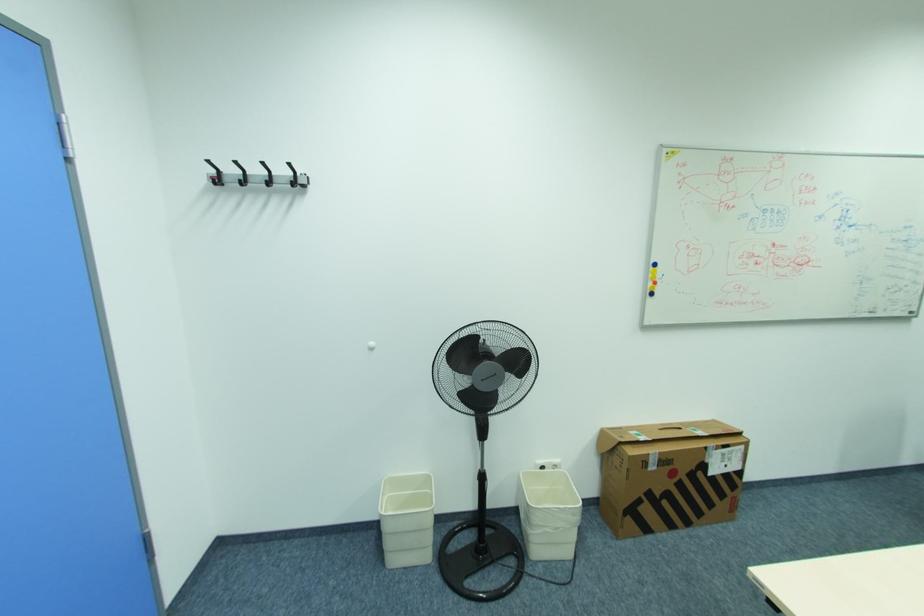
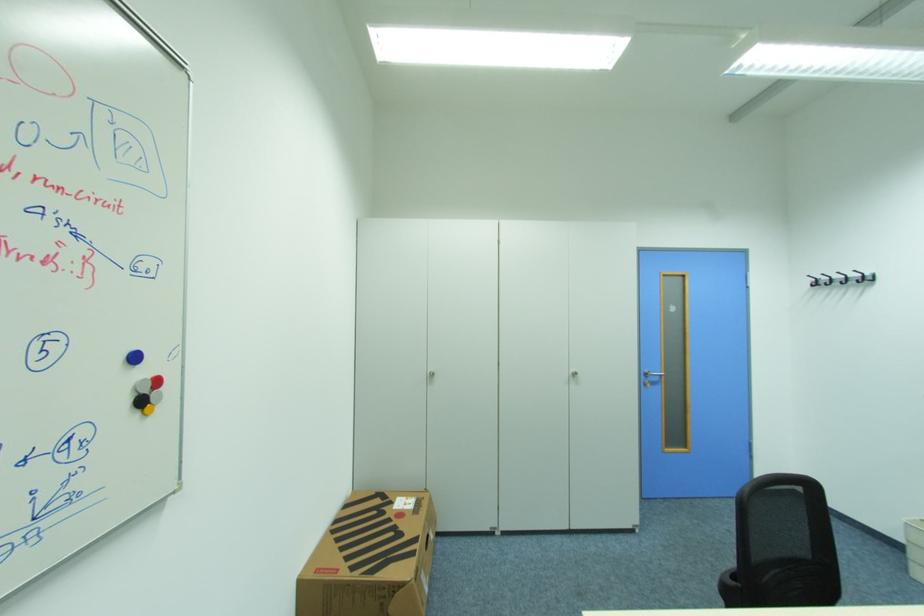
Find the pixel in the second image that matches point 302,175 in the first image.

(872, 275)